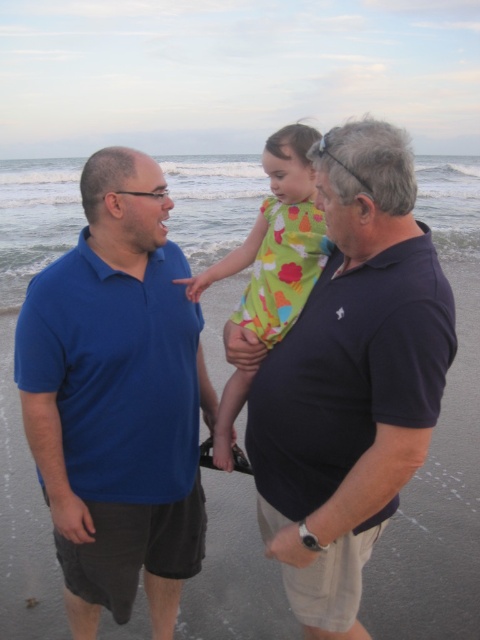
You are a photographer standing at the beach. You want to take a photo of the matte blue polo shirt at left and the dark blue cotton shirt at center. The minimum distance required for your camera to focus on both subjects clearly is 60 centimeters. Will you be able to capture both in focus without adjusting your position?

The matte blue polo shirt at left and dark blue cotton shirt at center are 58.18 centimeters apart. Since the required distance is 60 centimeters, the current separation is insufficient. Move slightly back or closer to the subjects to ensure both are within the focus range.

You are taking a photo of the two points in the image. The first point is at coordinate point(x=144, y=445) and the second point is at point(x=431, y=257). Which point will appear closer to the camera in the photo?

Point(x=144, y=445) is further to the camera than point(x=431, y=257), so it will appear closer in the photo.

You are a photographer positioned behind the matte blue polo shirt at left and the green floral dress at center. Which subject is closer to you?

The matte blue polo shirt at left is closer to you since it is positioned further to the viewer than the green floral dress at center.